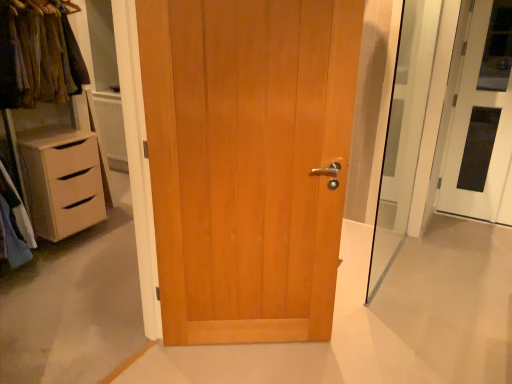
Identify the location of free space to the back side of transparent glass screen door at right. (381, 247).